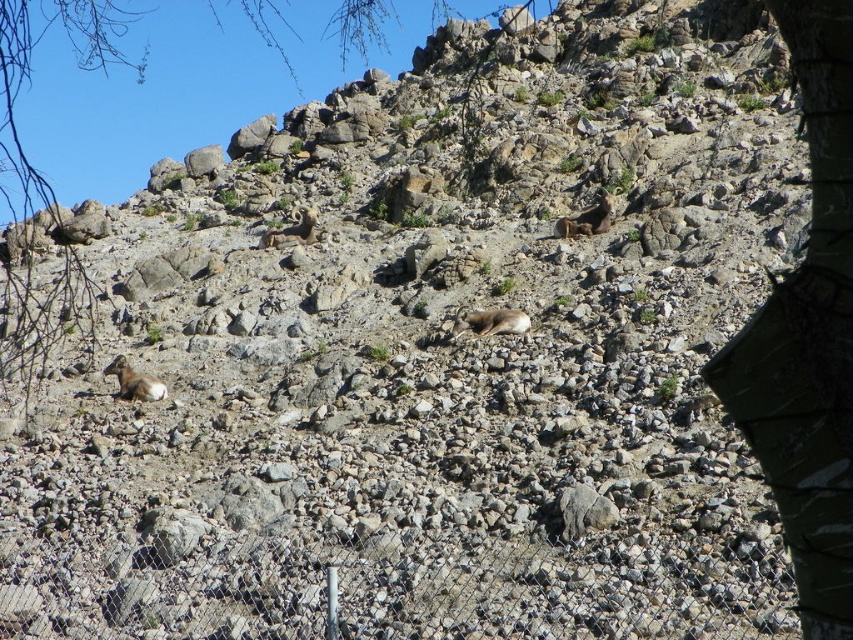
You are a hiker trying to spot the brown fur at center from the green camouflage tree at right. Which object would you need to climb to get a better view?

The green camouflage tree at right is taller than brown fur at center, so you can climb it to get a better view of the brown fur at center.

You are a wildlife photographer aiming to capture both the white woolly goat at lower left and the brown woolly sheep at upper center in the same frame. Given their sizes, which animal would appear larger in your photograph?

The white woolly goat at lower left would appear larger in the photograph because it is bigger than the brown woolly sheep at upper center.

You are an animal caretaker in a wildlife sanctuary. You need to place a new feeding station between the green camouflage tree at right and the green leafy tree at upper center. Which tree should the feeding station be closer to if it needs to be near the smaller tree?

The feeding station should be closer to the green camouflage tree at right because it has a smaller size compared to the green leafy tree at upper center.